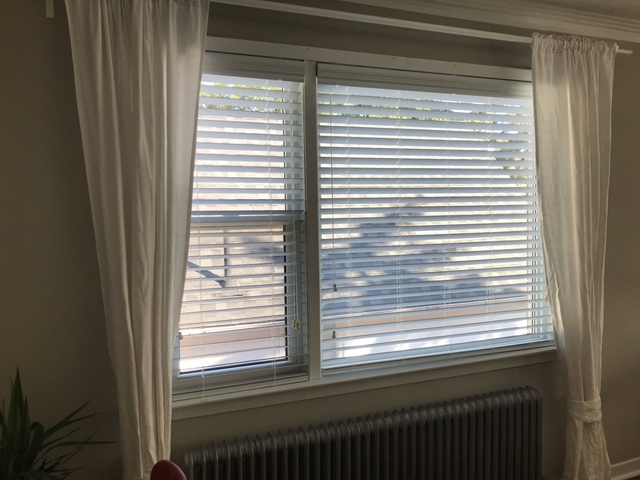
Where is `empty space on wall`? Image resolution: width=640 pixels, height=480 pixels. empty space on wall is located at coordinates (57, 213), (620, 233).